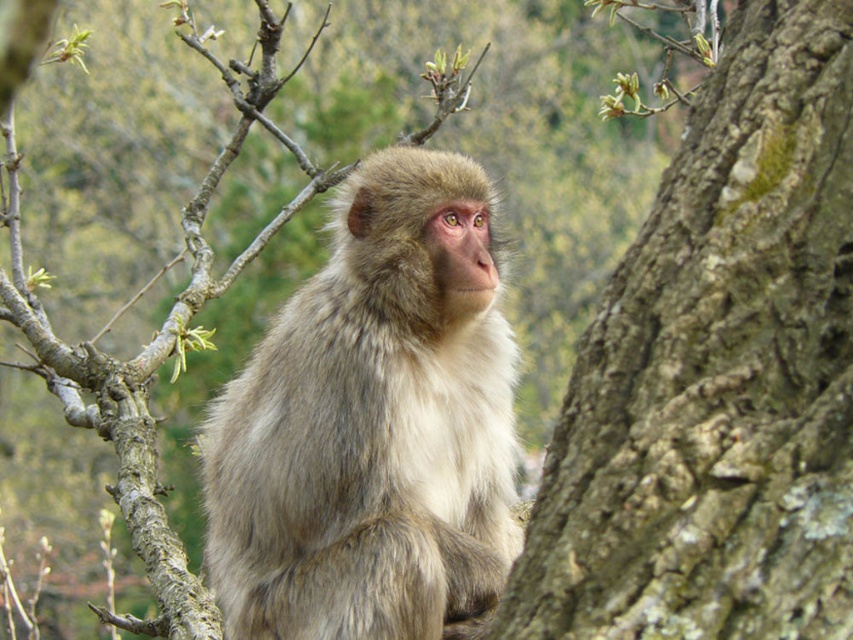
You are a botanist examining the tree in the image. You notice the brown rough bark at right. Can you determine its exact location in the image using coordinates?

The brown rough bark at right is located at coordinates point (717, 372).

You are a photographer trying to capture the monkey in the image. You notice the brown rough bark at right and the fuzzy fur monkey at center. Which object is positioned to the right side of the other?

The brown rough bark at right is to the right of the fuzzy fur monkey at center.

You are a photographer trying to capture a close shot of the brown rough bark at right and the fuzzy fur monkey at center. Which object will appear larger in your photo?

The fuzzy fur monkey at center will appear larger in the photo because it is bigger than the brown rough bark at right.